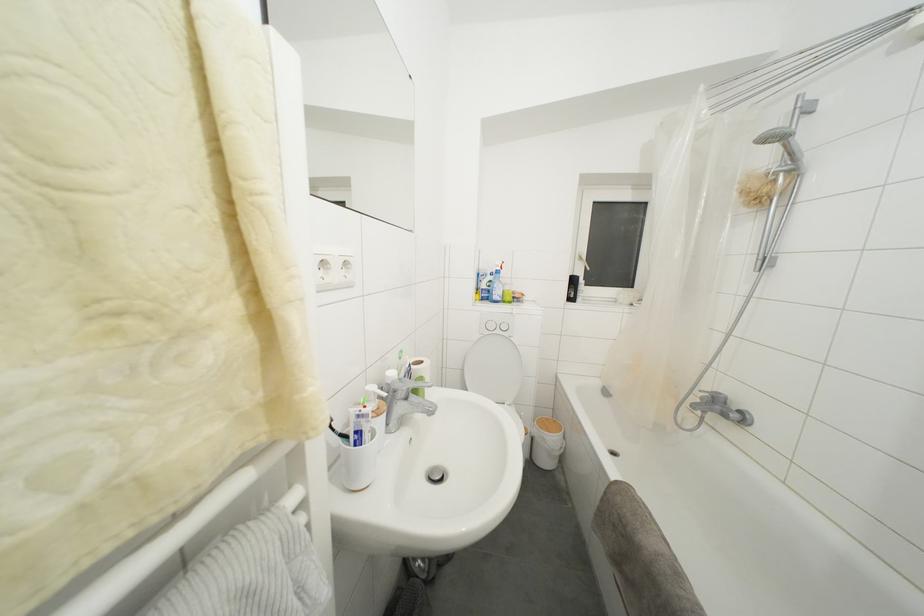
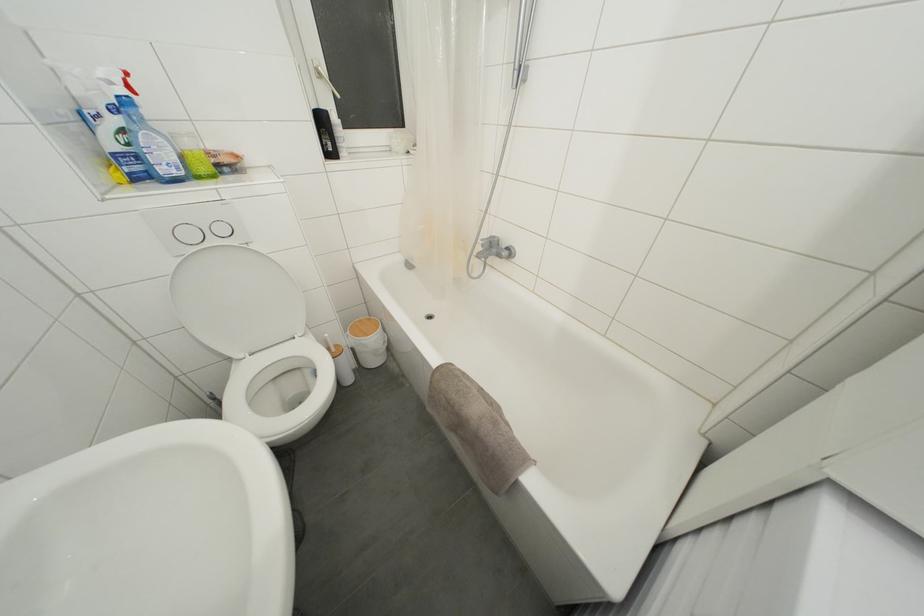
The point at (512,293) is marked in the first image. Where is the corresponding point in the second image?

(193, 148)